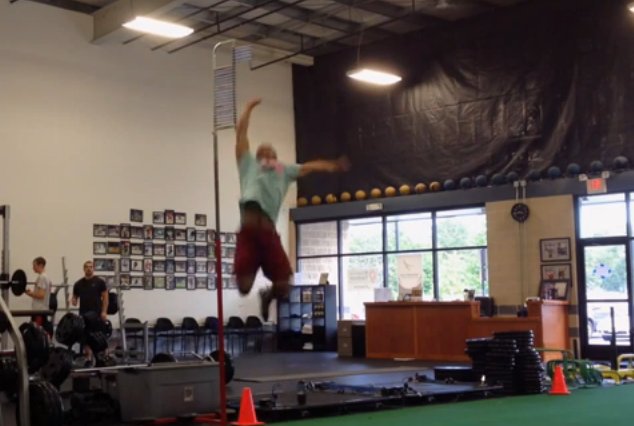
This screenshot has height=426, width=634. I want to click on long rectangular light, so pos(139,24).